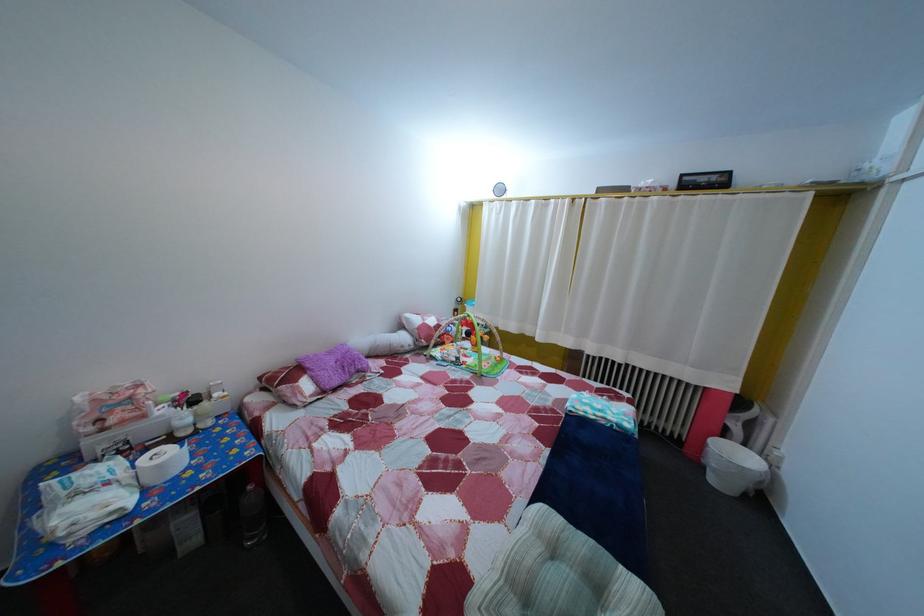
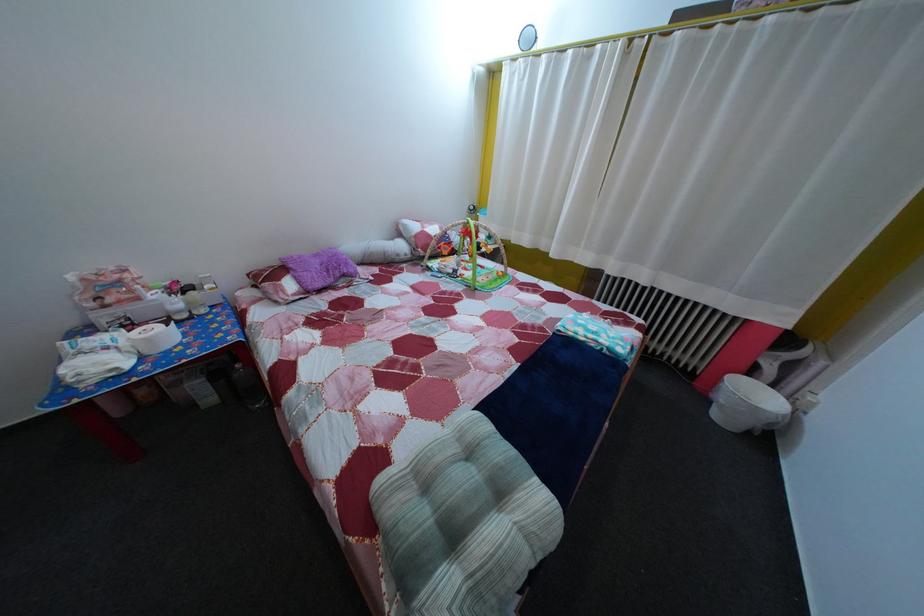
Find the pixel in the second image that matches pixel 456 350 in the first image.

(455, 261)